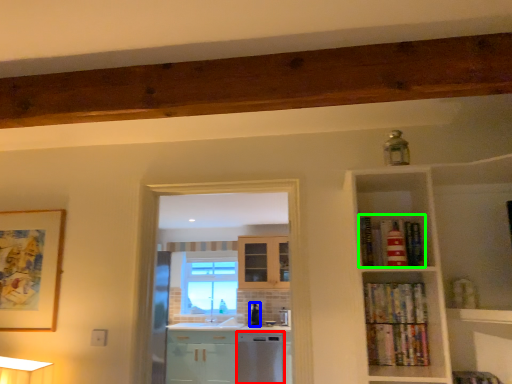
Question: Estimate the real-world distances between objects in this image. Which object is closer to dish washer (highlighted by a red box), appliance (highlighted by a blue box) or book (highlighted by a green box)?

Choices:
 (A) appliance
 (B) book

Answer: (A)